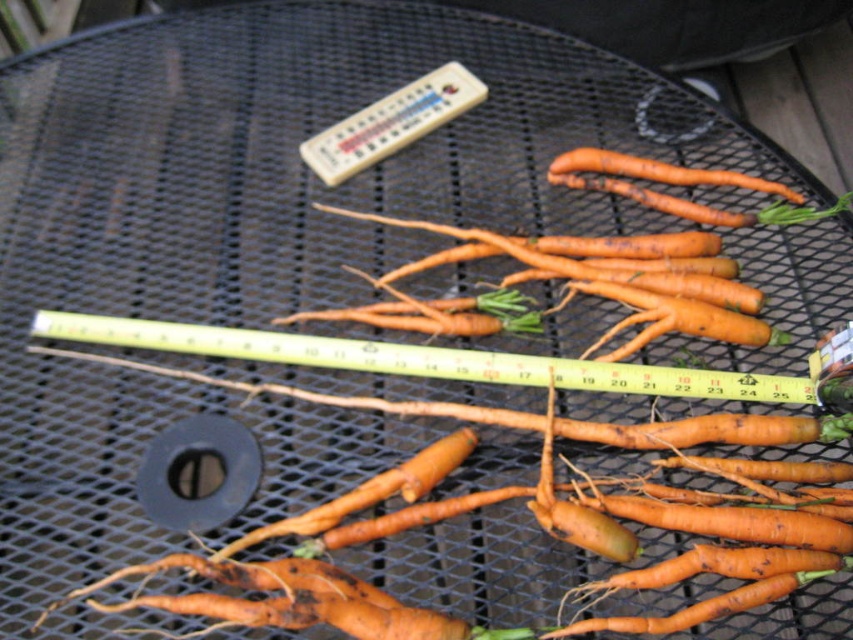
Question: Which object appears closest to the camera in this image?

Choices:
 (A) orange matte carrot at center
 (B) yellow plastic ruler at center

Answer: (B)

Question: In this image, where is yellow plastic ruler at center located relative to orange rough skin at upper center?

Choices:
 (A) right
 (B) left

Answer: (B)

Question: Is yellow plastic ruler at center above orange matte carrot at center?

Choices:
 (A) yes
 (B) no

Answer: (B)

Question: Which of the following is the closest to the observer?

Choices:
 (A) (467, 241)
 (B) (314, 340)

Answer: (B)

Question: Which point appears closest to the camera in this image?

Choices:
 (A) (413, 364)
 (B) (569, 164)

Answer: (A)

Question: Is orange matte carrot at center to the left of orange rough skin at upper center from the viewer's perspective?

Choices:
 (A) yes
 (B) no

Answer: (A)